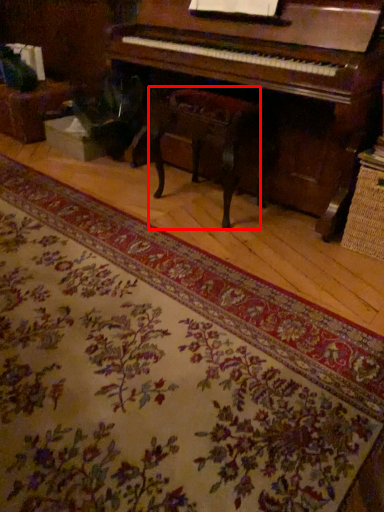
Question: Observing the image, what is the correct spatial positioning of music stool (annotated by the red box) in reference to mat?

Choices:
 (A) right
 (B) left

Answer: (A)